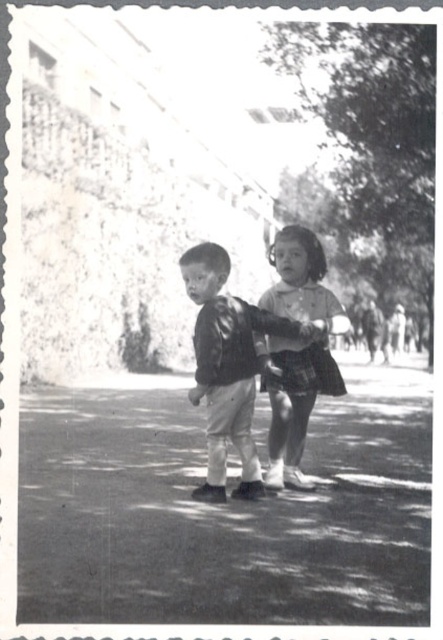
Question: Can you confirm if leather jacket at center is positioned to the right of plaid fabric dress at center?

Choices:
 (A) no
 (B) yes

Answer: (A)

Question: Which of the following is the closest to the observer?

Choices:
 (A) plaid fabric dress at center
 (B) leather jacket at center

Answer: (A)

Question: Which of the following is the farthest from the observer?

Choices:
 (A) (225, 412)
 (B) (275, 410)

Answer: (B)

Question: In this image, where is leather jacket at center located relative to plaid fabric dress at center?

Choices:
 (A) below
 (B) above

Answer: (A)

Question: Which point is closer to the camera?

Choices:
 (A) plaid fabric dress at center
 (B) leather jacket at center

Answer: (A)

Question: Does leather jacket at center have a larger size compared to plaid fabric dress at center?

Choices:
 (A) no
 (B) yes

Answer: (B)